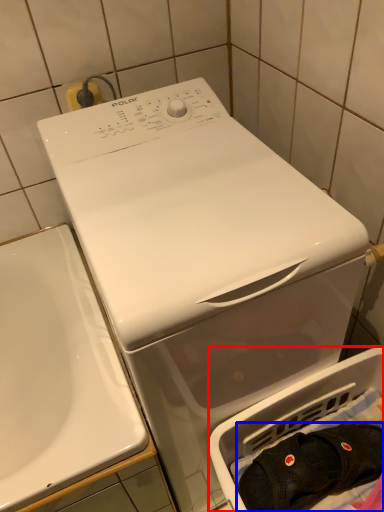
Question: Which object appears farthest to the camera in this image, dish washer (highlighted by a red box) or clothing (highlighted by a blue box)?

Choices:
 (A) dish washer
 (B) clothing

Answer: (B)